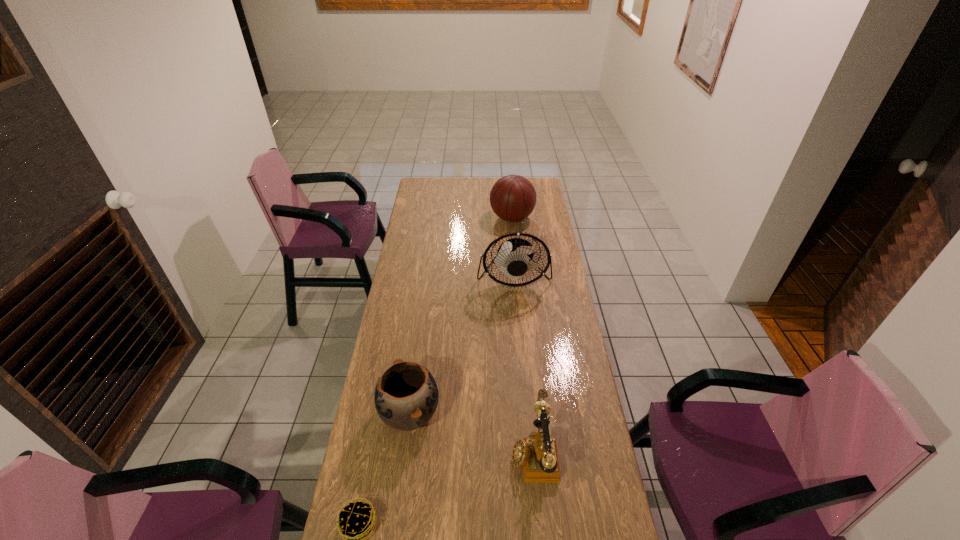
Find the location of a particular element. The image size is (960, 540). vacant space situated on the dial number of the telephone is located at coordinates (461, 451).

The height and width of the screenshot is (540, 960). In order to click on free space located on the front of the pottery in this screenshot , I will do `click(398, 499)`.

Find the location of a particular element. object positioned at the left edge is located at coordinates (406, 396).

The image size is (960, 540). I want to click on fan present at the right edge, so click(512, 259).

Image resolution: width=960 pixels, height=540 pixels. In order to click on basketball at the right edge in this screenshot , I will do `click(512, 198)`.

The image size is (960, 540). What are the coordinates of `telephone that is at the right edge` in the screenshot? It's located at (538, 456).

Find the location of `blank area at the left edge`. blank area at the left edge is located at coordinates (394, 495).

Locate an element on the screen. The height and width of the screenshot is (540, 960). free location at the right edge is located at coordinates (572, 339).

The image size is (960, 540). I want to click on free spot at the far left corner of the desktop, so click(x=442, y=181).

Where is `free point between the tallest object and the pottery`? The image size is (960, 540). free point between the tallest object and the pottery is located at coordinates (462, 345).